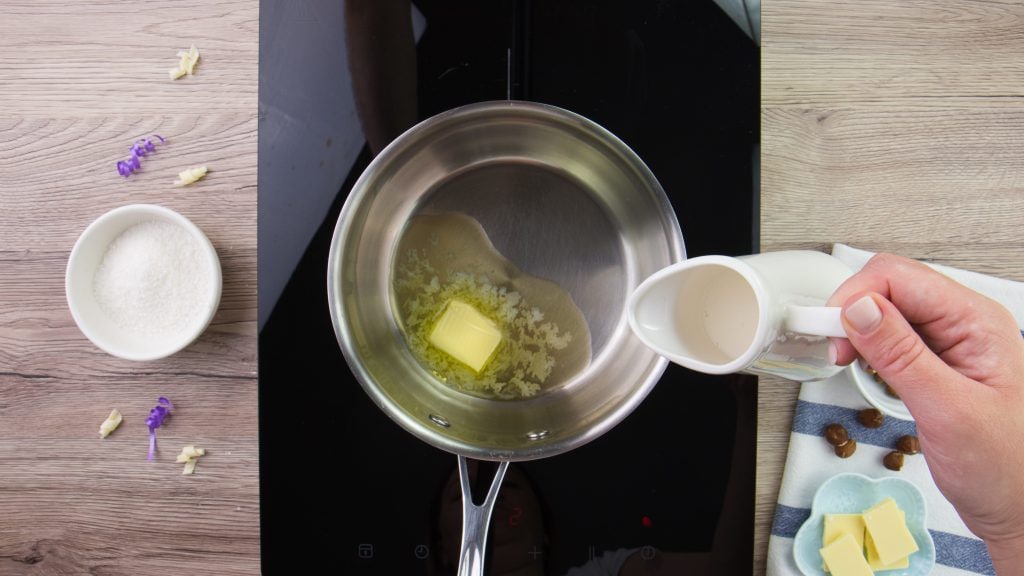
This screenshot has height=576, width=1024. Identify the location of sliver small cooking pan. (422, 130).